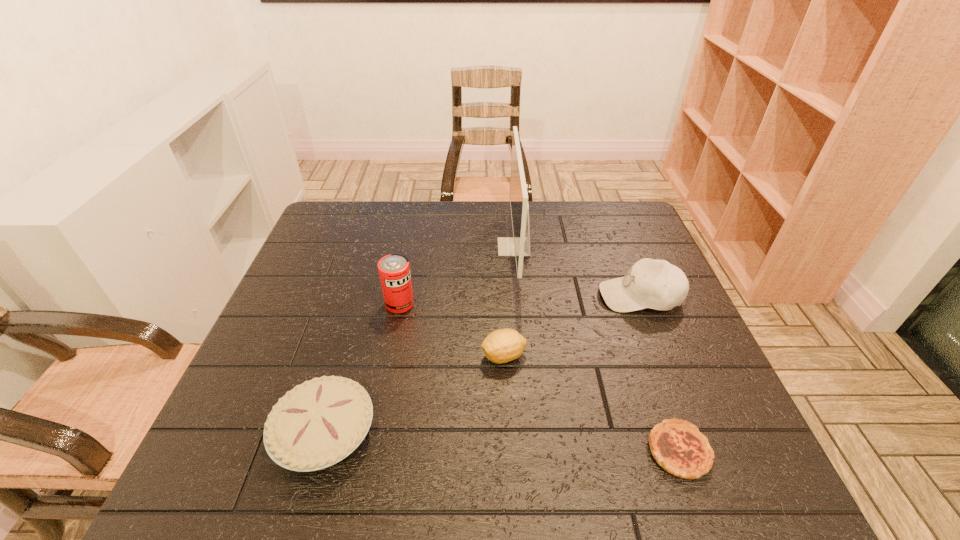
Image resolution: width=960 pixels, height=540 pixels. What are the coordinates of `vacant space that's between the baseball cap and the pie` in the screenshot? It's located at (482, 364).

Identify which object is the third nearest to the baseball cap. Please provide its 2D coordinates. Your answer should be formatted as a tuple, i.e. [(x, y)], where the tuple contains the x and y coordinates of a point satisfying the conditions above.

[(677, 446)]

You are a GUI agent. You are given a task and a screenshot of the screen. Output one action in this format:
    pyautogui.click(x=<x>, y=<y>)
    Task: Click on the object identified as the third closest to the second tallest object
    The height and width of the screenshot is (540, 960).
    Given the screenshot: What is the action you would take?
    pyautogui.click(x=519, y=246)

Identify the location of vacant region that satisfies the following two spatial constraints: 1. at the stem end of the shortest object; 2. on the left side of the fourth farthest object. This screenshot has height=540, width=960. (509, 451).

You are a GUI agent. You are given a task and a screenshot of the screen. Output one action in this format:
    pyautogui.click(x=<x>, y=<y>)
    Task: Click on the free point that satisfies the following two spatial constraints: 1. on the front-facing side of the tallest object; 2. on the front side of the pie
    The height and width of the screenshot is (540, 960).
    Given the screenshot: What is the action you would take?
    pyautogui.click(x=531, y=432)